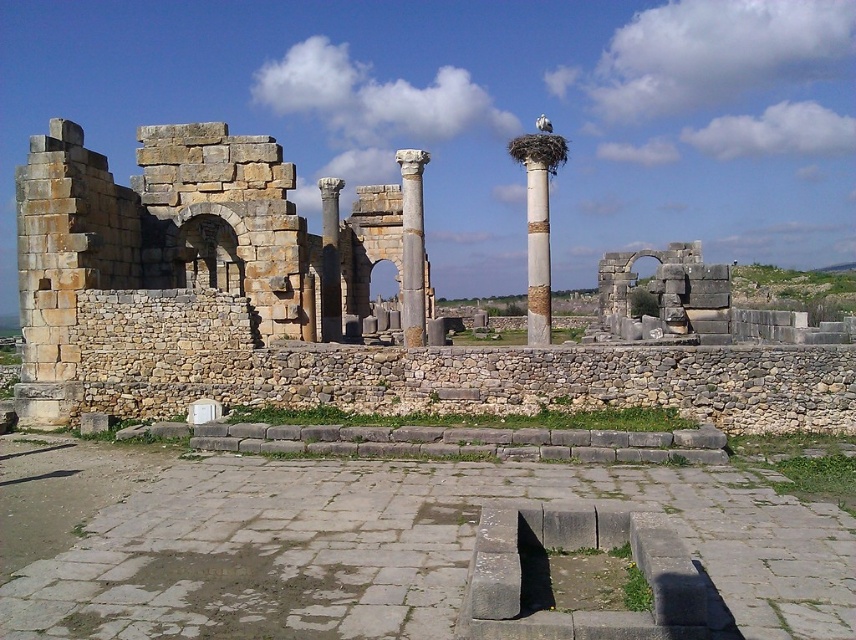
You are a GUI agent. You are given a task and a screenshot of the screen. Output one action in this format:
    pyautogui.click(x=<x>, y=<y>)
    Task: Click on the rustic stone column at center
    This screenshot has width=856, height=640.
    Given the screenshot: What is the action you would take?
    pyautogui.click(x=538, y=224)

In the scene shown: Can you confirm if rustic stone column at center is positioned above smooth stone column at center?

Incorrect, rustic stone column at center is not positioned above smooth stone column at center.

Which is behind, point (554, 164) or point (337, 262)?

Positioned behind is point (337, 262).

I want to click on rustic stone column at center, so click(538, 224).

Is yellowish stone ruins at center positioned at the back of stone archway at center?

No.

Is yellowish stone ruins at center to the left of stone archway at center from the viewer's perspective?

Correct, you'll find yellowish stone ruins at center to the left of stone archway at center.

Where is `yellowish stone ruins at center`? The width and height of the screenshot is (856, 640). yellowish stone ruins at center is located at coordinates (155, 252).

Does stone archway at center lie behind white marble column at center?

Yes, it is behind white marble column at center.

Is point (681, 253) positioned behind point (545, 301)?

Yes, point (681, 253) is behind point (545, 301).

Where is `stone archway at center`? stone archway at center is located at coordinates (664, 292).

Locate an element on the screen. stone archway at center is located at coordinates (664, 292).